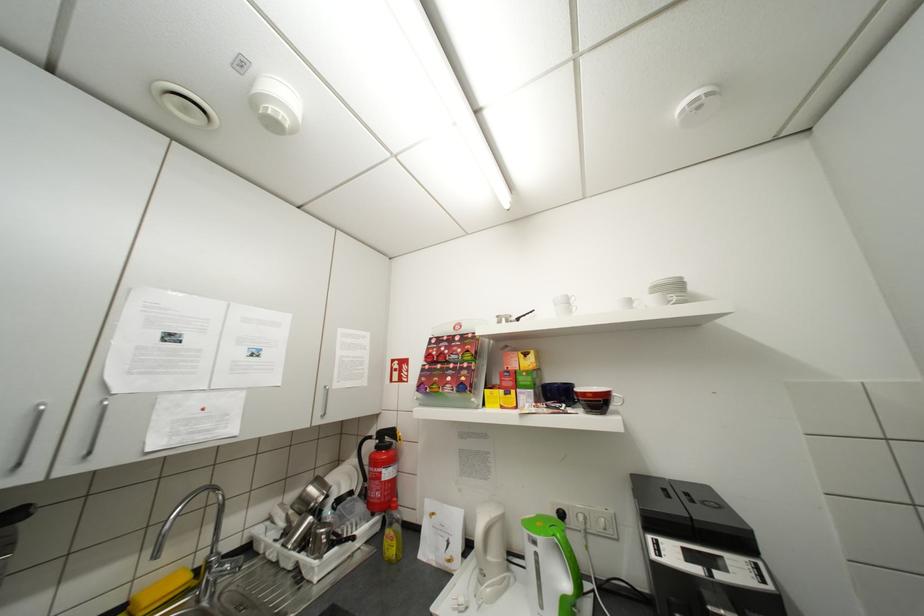
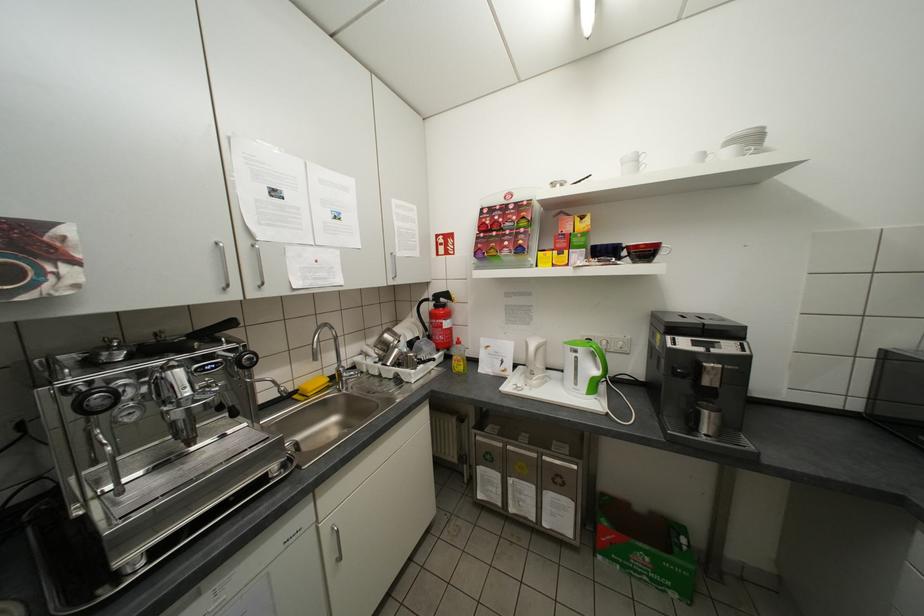
Where in the second image is the point corresponding to [548,583] from the first image?

(585, 373)